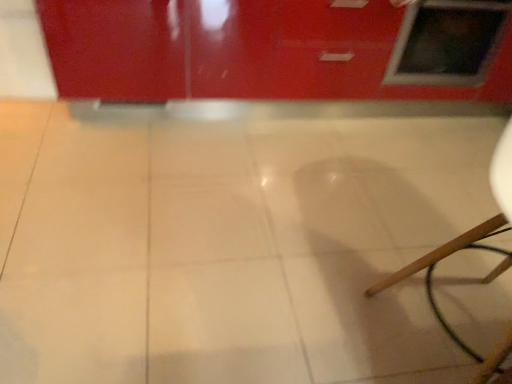
Question: Is matte glass window at upper right at the back of white glossy tile at center?

Choices:
 (A) no
 (B) yes

Answer: (A)

Question: Can you confirm if white glossy tile at center is smaller than matte glass window at upper right?

Choices:
 (A) no
 (B) yes

Answer: (A)

Question: Does white glossy tile at center contain matte glass window at upper right?

Choices:
 (A) yes
 (B) no

Answer: (B)

Question: From the image's perspective, is white glossy tile at center under matte glass window at upper right?

Choices:
 (A) yes
 (B) no

Answer: (A)

Question: Is white glossy tile at center at the left side of matte glass window at upper right?

Choices:
 (A) yes
 (B) no

Answer: (A)

Question: Is white glossy tile at center not within matte glass window at upper right?

Choices:
 (A) no
 (B) yes

Answer: (B)

Question: Is matte glass window at upper right completely or partially outside of white glossy tile at center?

Choices:
 (A) yes
 (B) no

Answer: (A)

Question: Is matte glass window at upper right to the right of white glossy tile at center from the viewer's perspective?

Choices:
 (A) yes
 (B) no

Answer: (A)

Question: From a real-world perspective, is matte glass window at upper right below white glossy tile at center?

Choices:
 (A) no
 (B) yes

Answer: (A)

Question: From the image's perspective, does matte glass window at upper right appear higher than white glossy tile at center?

Choices:
 (A) yes
 (B) no

Answer: (A)

Question: Is matte glass window at upper right shorter than white glossy tile at center?

Choices:
 (A) yes
 (B) no

Answer: (B)

Question: From the image's perspective, is matte glass window at upper right located beneath white glossy tile at center?

Choices:
 (A) no
 (B) yes

Answer: (A)

Question: In the image, is matte glass window at upper right positioned in front of or behind white glossy tile at center?

Choices:
 (A) behind
 (B) front

Answer: (A)